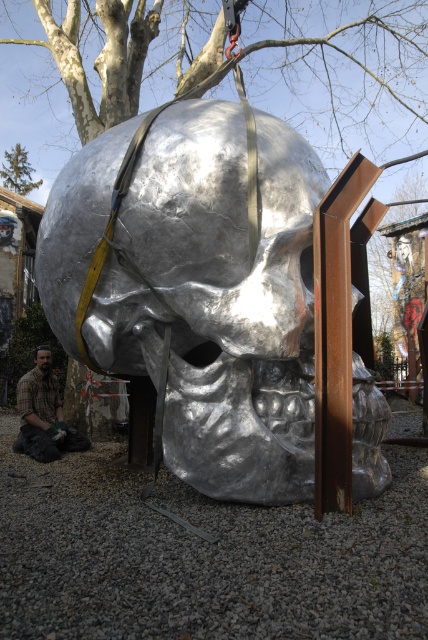
Which is in front, point (70, 448) or point (12, 170)?

Point (70, 448) is in front.

Does brown plaid shirt at lower left have a greater width compared to green coniferous tree at upper left?

Incorrect, brown plaid shirt at lower left's width does not surpass green coniferous tree at upper left's.

What do you see at coordinates (44, 413) in the screenshot?
I see `brown plaid shirt at lower left` at bounding box center [44, 413].

You are a GUI agent. You are given a task and a screenshot of the screen. Output one action in this format:
    pyautogui.click(x=<x>, y=<y>)
    Task: Click on the brown plaid shirt at lower left
    
    Given the screenshot: What is the action you would take?
    pyautogui.click(x=44, y=413)

Between point (302, 269) and point (36, 412), which one is positioned behind?

Positioned behind is point (36, 412).

The image size is (428, 640). Describe the element at coordinates (198, 289) in the screenshot. I see `metallic skull at center` at that location.

Locate an element on the screen. metallic skull at center is located at coordinates click(198, 289).

Is metallic skull at center to the left of green coniferous tree at upper left from the viewer's perspective?

In fact, metallic skull at center is to the right of green coniferous tree at upper left.

Does metallic skull at center have a lesser height compared to green coniferous tree at upper left?

Incorrect, metallic skull at center's height does not fall short of green coniferous tree at upper left's.

This screenshot has height=640, width=428. What do you see at coordinates (198, 289) in the screenshot? I see `metallic skull at center` at bounding box center [198, 289].

Where is `metallic skull at center`? metallic skull at center is located at coordinates (198, 289).